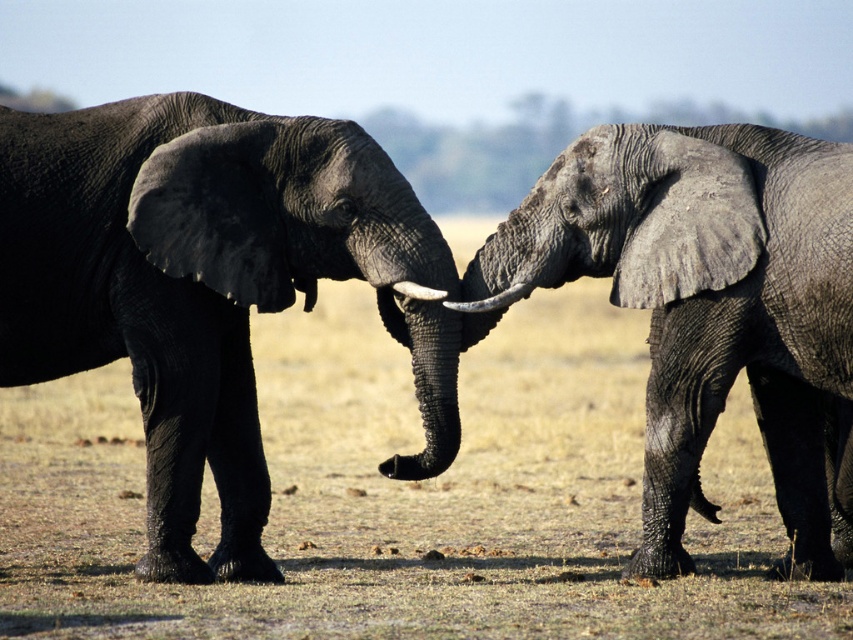
You are a wildlife photographer aiming to capture the gray textured elephant at left and the white smooth tusk at center in a single frame. Given that your camera can only focus on one subject at a time, which elephant should you focus on to ensure the other remains in the background?

The gray textured elephant at left is larger in size compared to the white smooth tusk at center, so focusing on the gray textured elephant at left would keep the smaller white smooth tusk at center in the background.

You are standing in the savanna and looking at the two elephants. There are two points marked in the image. The first point is at coordinates point (30,262) and the second point is at point (434,296). Which point is closer to you?

Point (30,262) is further to the camera than point (434,296), so the point closer to you is point (434,296).

You are a photographer standing in the savanna and want to capture a closeup shot of the brown dry grass at center. Based on the scene description, can you determine if you need to move closer or farther away from the grass?

The brown dry grass at center is 8.77 meters away from camera, so you need to move closer to get a closeup shot since it is farther than the ideal distance for a closeup.